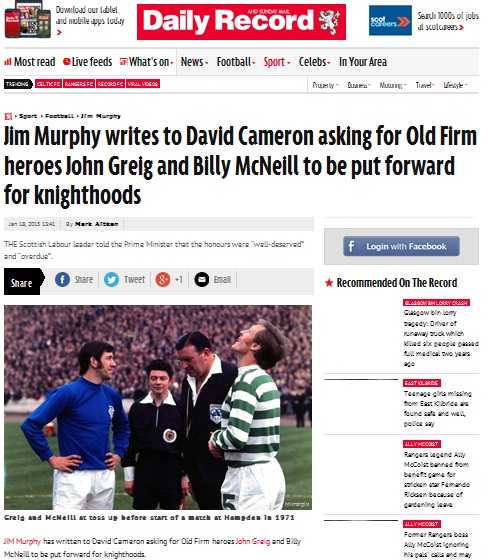
Locate an element on the screen. fans is located at coordinates (47, 344).